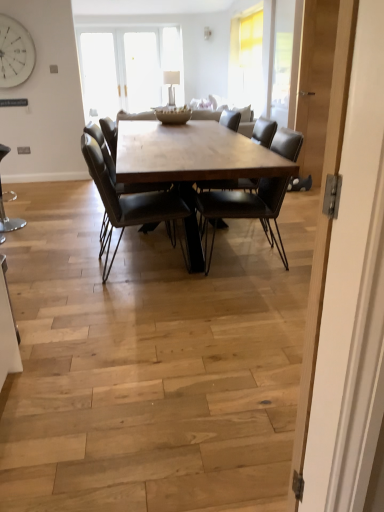
Question: From a real-world perspective, is leather chair at center, which is the 2th chair from left to right, positioned above or below metallic stool at lower left, the 1th chair from the left?

Choices:
 (A) below
 (B) above

Answer: (B)

Question: Considering the positions of point (173, 197) and point (0, 229), is point (173, 197) closer or farther from the camera than point (0, 229)?

Choices:
 (A) closer
 (B) farther

Answer: (B)

Question: Considering the real-world distances, which object is closest to the matte black chair at center, the first chair positioned from the right?

Choices:
 (A) wooden table at center
 (B) metallic stool at lower left, the 1th chair from the left
 (C) leather chair at center, marked as the second chair in a right-to-left arrangement
 (D) light wood door at center
 (E) white matte clock at upper left

Answer: (A)

Question: Based on their relative distances, which object is nearer to the metallic stool at lower left, the 1th chair from the left?

Choices:
 (A) white matte clock at upper left
 (B) matte black chair at center, which ranks as the third chair in left-to-right order
 (C) light wood door at center
 (D) leather chair at center, marked as the second chair in a right-to-left arrangement
 (E) wooden table at center

Answer: (D)